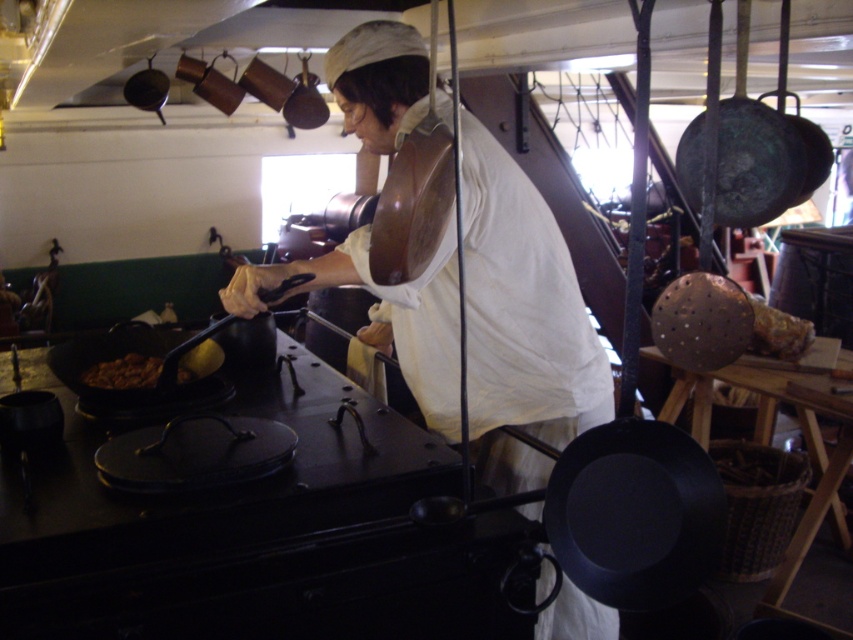
Looking at this image, can you confirm if green patina metal frying pan at upper right is positioned to the left of black matte wok at left?

Incorrect, green patina metal frying pan at upper right is not on the left side of black matte wok at left.

Which is in front, point (767, 180) or point (171, 332)?

Positioned in front is point (767, 180).

Image resolution: width=853 pixels, height=640 pixels. What do you see at coordinates (755, 163) in the screenshot? I see `green patina metal frying pan at upper right` at bounding box center [755, 163].

What are the coordinates of `green patina metal frying pan at upper right` in the screenshot? It's located at (755, 163).

Who is lower down, white matte apron at center or shiny copper frying pan at upper left?

Positioned lower is white matte apron at center.

Describe the element at coordinates (521, 321) in the screenshot. I see `white matte apron at center` at that location.

Image resolution: width=853 pixels, height=640 pixels. I want to click on white matte apron at center, so click(521, 321).

Is black matte wok at left positioned before shiny copper frying pan at upper left?

Yes, black matte wok at left is in front of shiny copper frying pan at upper left.

Describe the element at coordinates (140, 387) in the screenshot. The height and width of the screenshot is (640, 853). I see `black matte wok at left` at that location.

Who is more distant from viewer, (138, 332) or (161, 84)?

The point (161, 84) is more distant.

Identify the location of black matte wok at left. (140, 387).